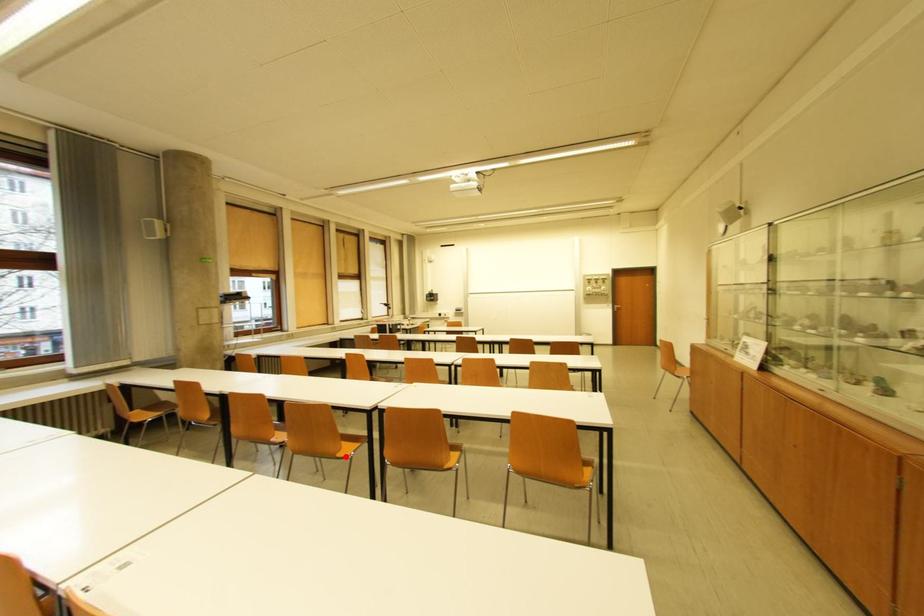
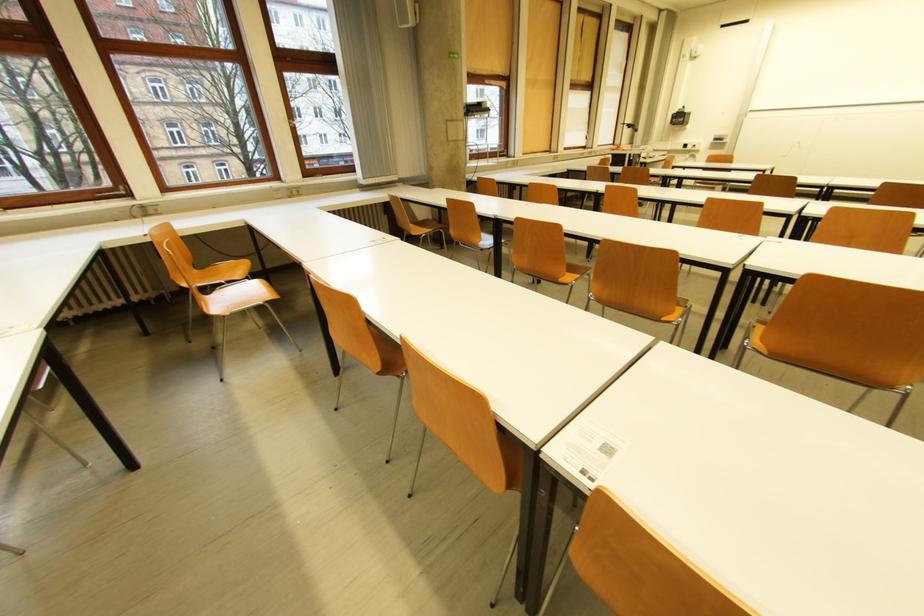
In the second image, find the point that corresponds to the highlighted location in the first image.

(671, 320)